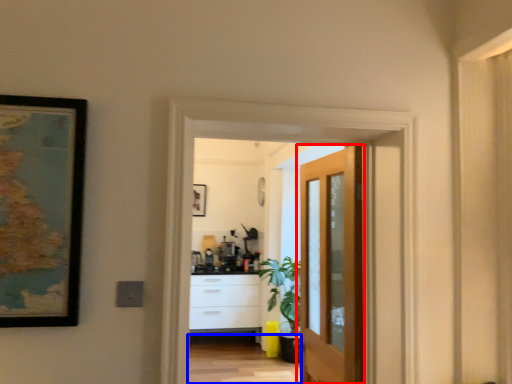
Question: Which point is further to the camera, door (highlighted by a red box) or path (highlighted by a blue box)?

Choices:
 (A) door
 (B) path

Answer: (B)